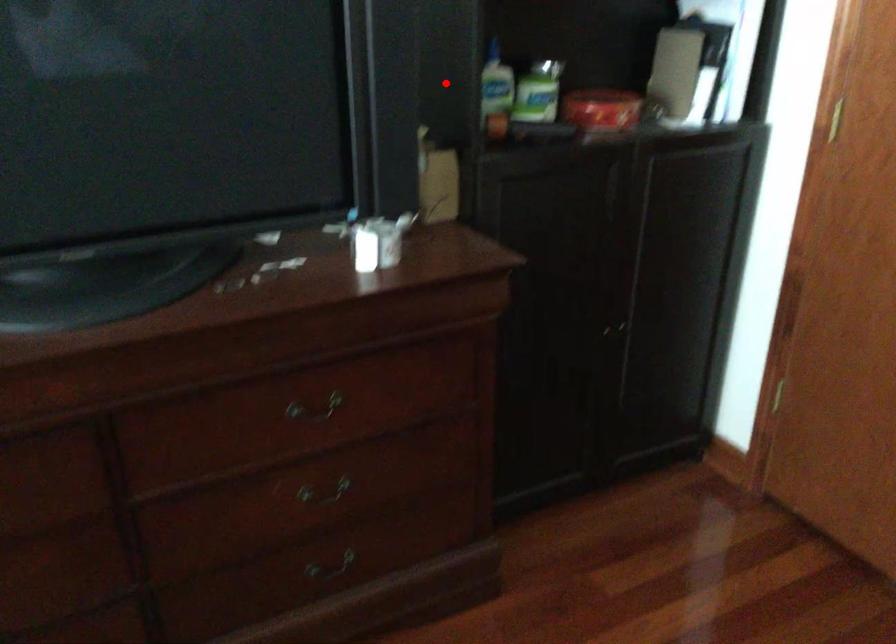
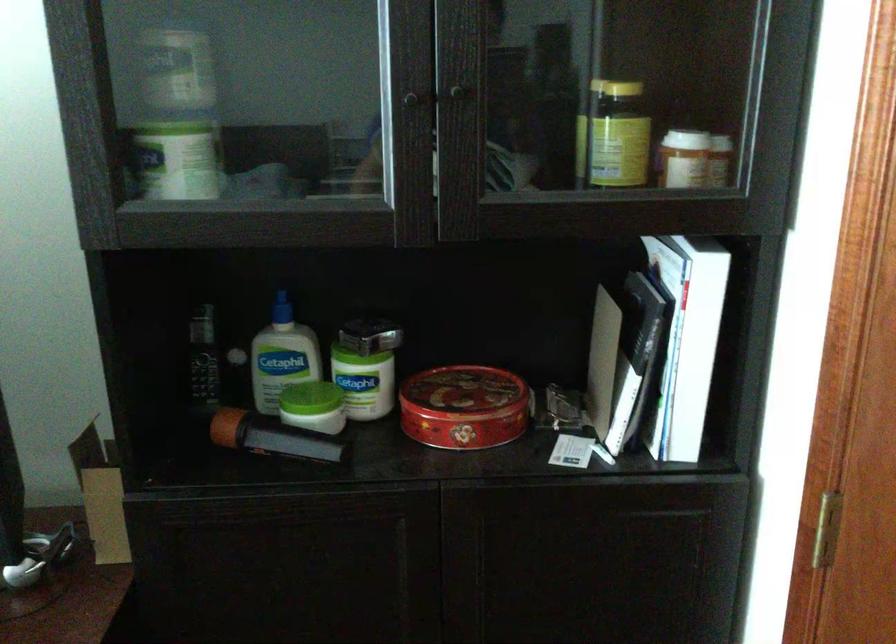
Where in the second image is the point corresponding to the highlighted location from the first image?

(202, 357)